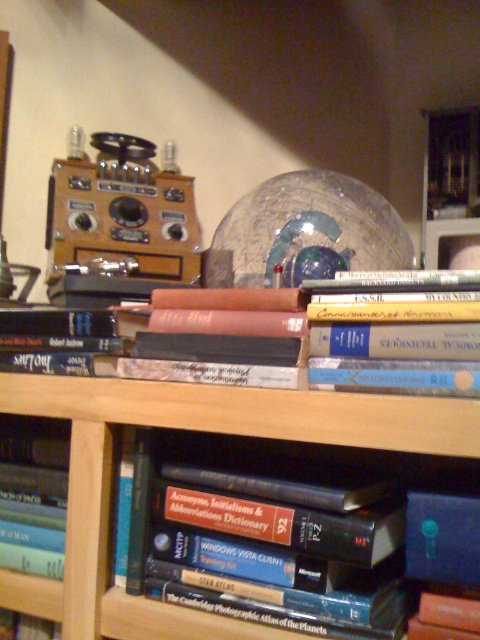
You are organizing the books on the wooden bookshelf and notice two items labeled as hardcover book at center and hardcover books at center. Which one is placed on top of the other?

The hardcover book at center is positioned over hardcover books at center.

You are organizing books on a shelf and need to place a new book between the hardcover books at center and the blue hardcover book at lower left. Based on their positions, where should the new book be placed?

The new book should be placed between the blue hardcover book at lower left and the hardcover books at center since the hardcover books at center is to the right of blue hardcover book at lower left.

You are organizing a bookshelf and want to place a new book behind the hardcover book at center. Can you do this without moving the blue hardcover book at lower left?

The hardcover book at center is in front of the blue hardcover book at lower left, so placing a new book behind the hardcover book at center would require moving the blue hardcover book at lower left since it is already behind it.